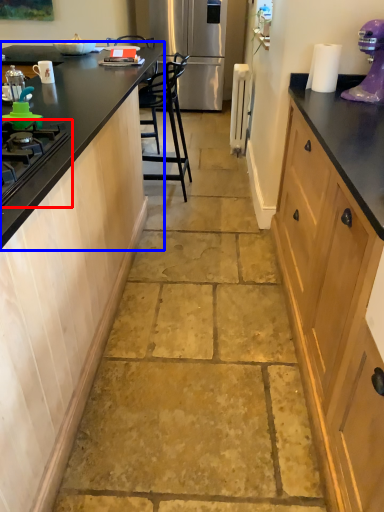
Question: Which object appears farthest to the camera in this image, gas stove (highlighted by a red box) or countertop (highlighted by a blue box)?

Choices:
 (A) gas stove
 (B) countertop

Answer: (B)